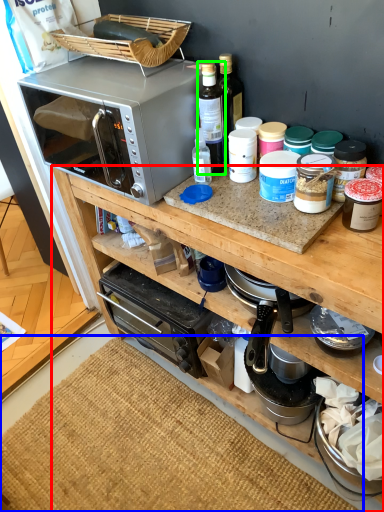
Question: Which is nearer to the cabinetry (highlighted by a red box)? mat (highlighted by a blue box) or bottle (highlighted by a green box).

Choices:
 (A) mat
 (B) bottle

Answer: (B)